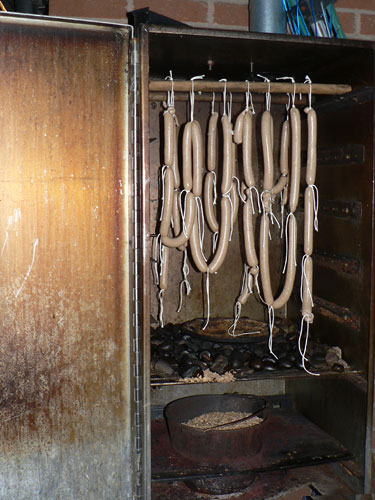
This screenshot has width=375, height=500. In order to click on top shelf in this screenshot , I will do `click(305, 364)`.